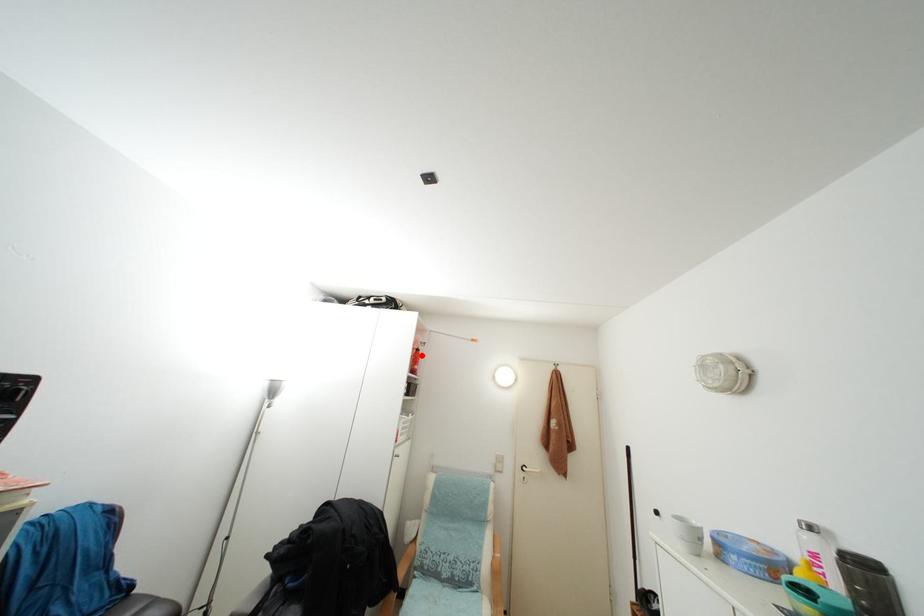
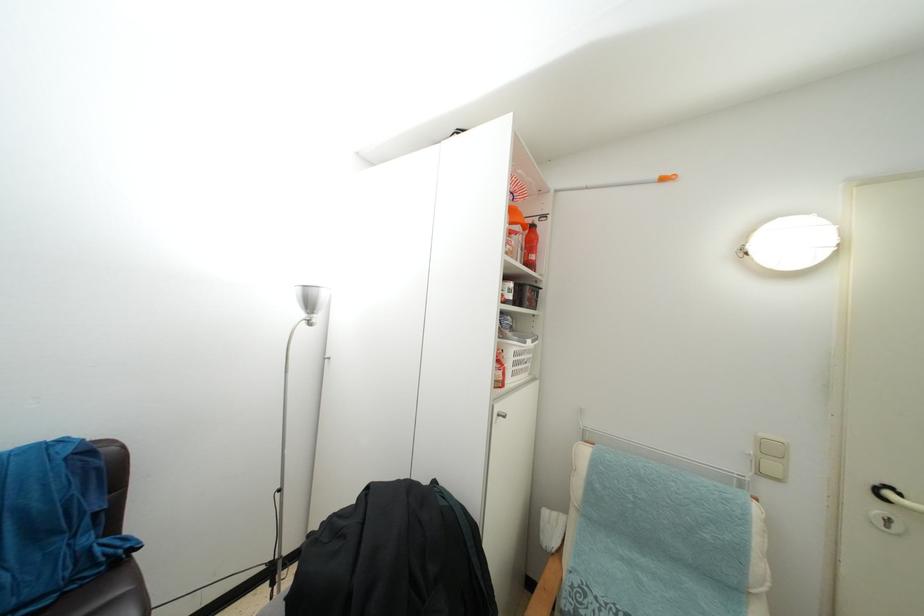
Locate, in the second image, the point that corresponds to the highlighted location in the first image.

(537, 233)